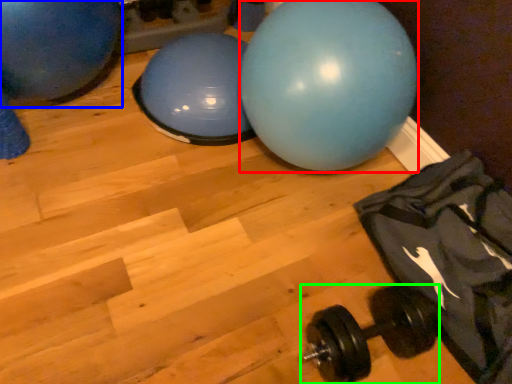
Question: Estimate the real-world distances between objects in this image. Which object is closer to ball (highlighted by a red box), ball (highlighted by a blue box) or dumbbell (highlighted by a green box)?

Choices:
 (A) ball
 (B) dumbbell

Answer: (B)